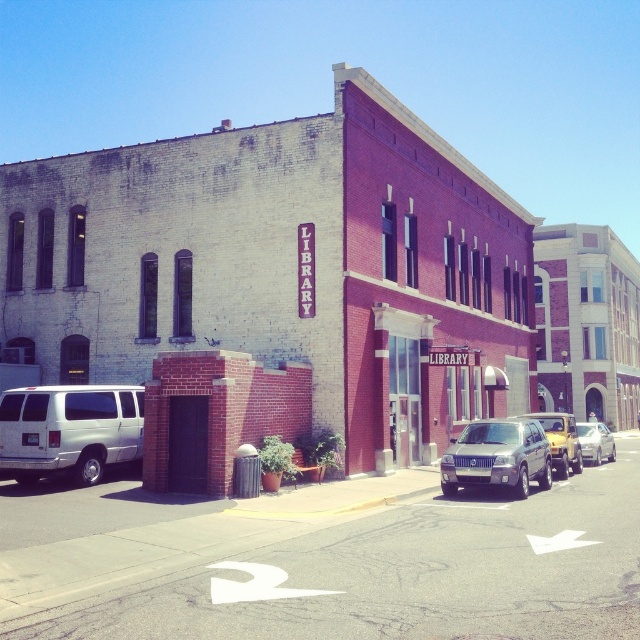
Is point (67, 269) more distant than point (612, 456)?

No, (67, 269) is closer to viewer.

Which of these two, white brick building at center or silver metallic sedan at center right, stands taller?

white brick building at center is taller.

Between point (355, 440) and point (595, 445), which one is positioned in front?

Point (355, 440) is more forward.

Where is `white brick building at center`? white brick building at center is located at coordinates (314, 285).

Who is more distant from viewer, (x=10, y=440) or (x=513, y=426)?

The point (x=513, y=426) is behind.

Who is higher up, white matte van at left or satin silver suv at center?

Positioned higher is white matte van at left.

Is point (26, 468) less distant than point (474, 461)?

That is True.

You are a GUI agent. You are given a task and a screenshot of the screen. Output one action in this format:
    pyautogui.click(x=<x>, y=<y>)
    Task: Click on the white matte van at left
    The width and height of the screenshot is (640, 640).
    Given the screenshot: What is the action you would take?
    pyautogui.click(x=68, y=429)

Does white brick building at center appear on the left side of white matte van at left?

No, white brick building at center is not to the left of white matte van at left.

Between point (224, 168) and point (134, 420), which one is positioned behind?

The point (224, 168) is behind.

Which is in front, point (483, 368) or point (22, 440)?

Point (22, 440) is in front.

Identify the location of white brick building at center. This screenshot has width=640, height=640. (314, 285).